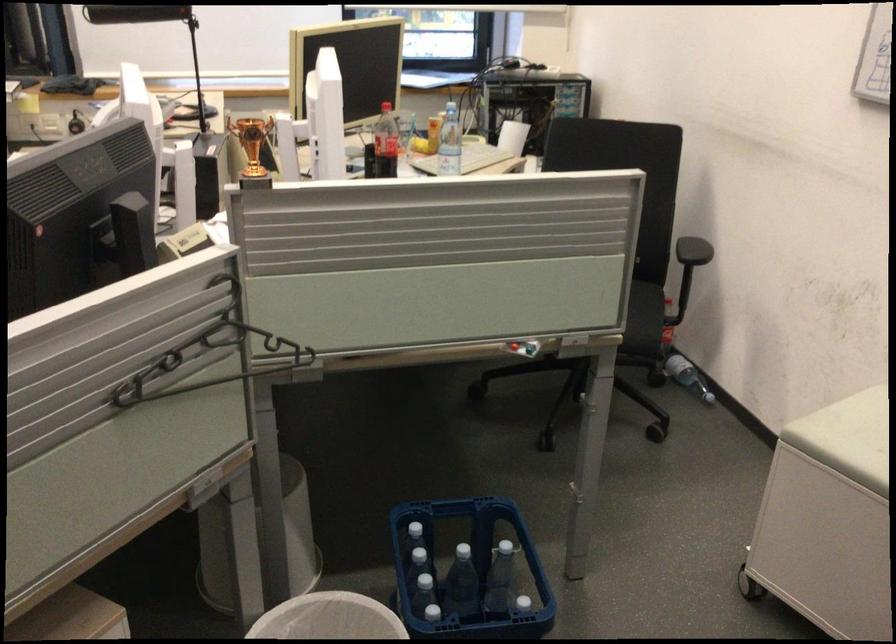
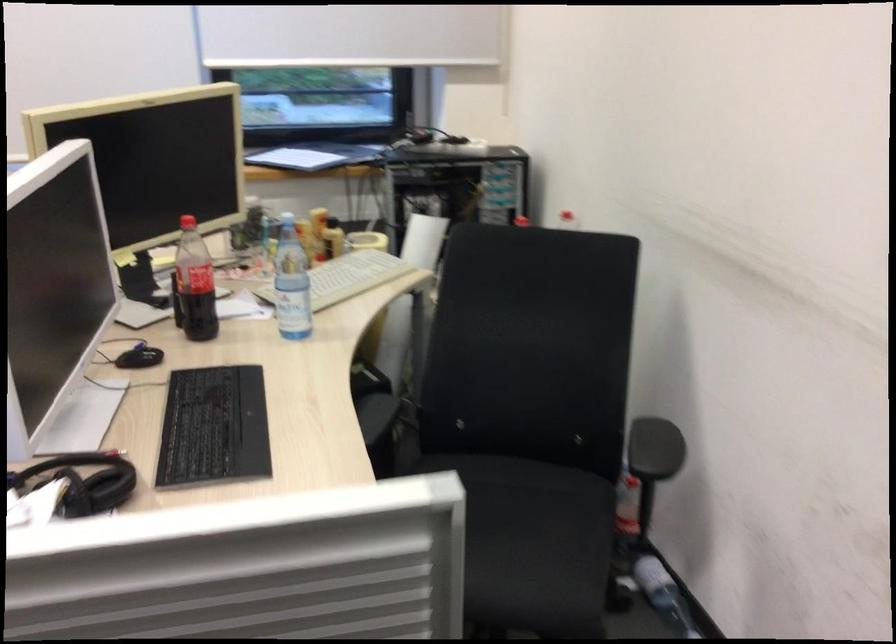
The point at (382,146) is marked in the first image. Where is the corresponding point in the second image?

(194, 283)